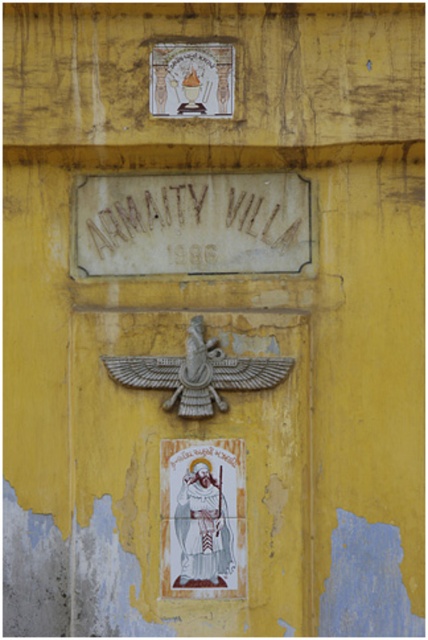
You are standing in front of the yellow wall and want to hang a new picture that is the same height as the matte white stone plaque at upper center. Given the white glossy saint at center is already mounted, will there be enough vertical space between them if you place the new picture directly below the saint?

The white glossy saint at center is taller than the matte white stone plaque at upper center. Since the new picture will be the same height as the smaller plaque, placing it directly below the saint would leave sufficient vertical space as the saint itself takes up more height.

You are standing in front of the wall and want to read both the brown stone sign at center and the matte white stone plaque at upper center. Which object is closer to you?

The brown stone sign at center is closer to you because the matte white stone plaque at upper center is behind it.